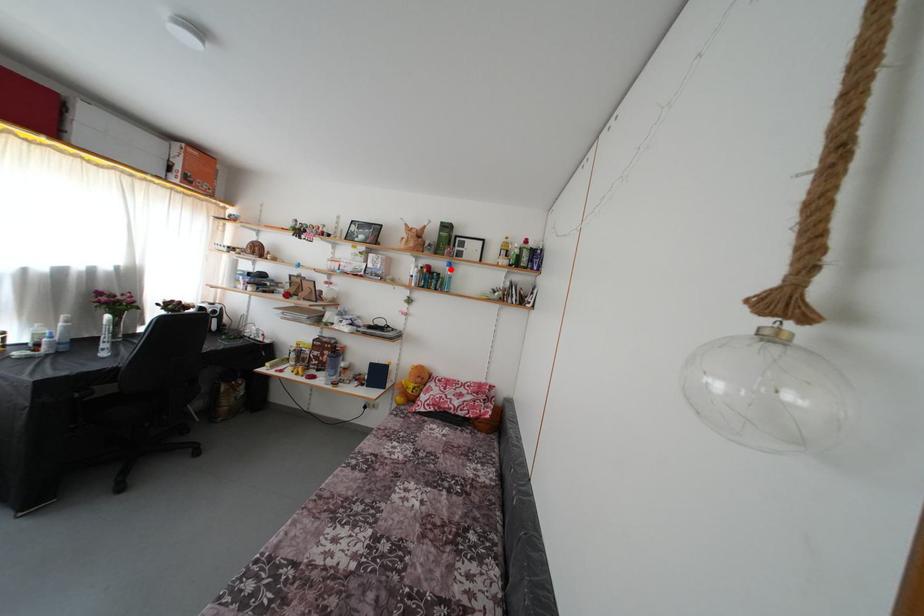
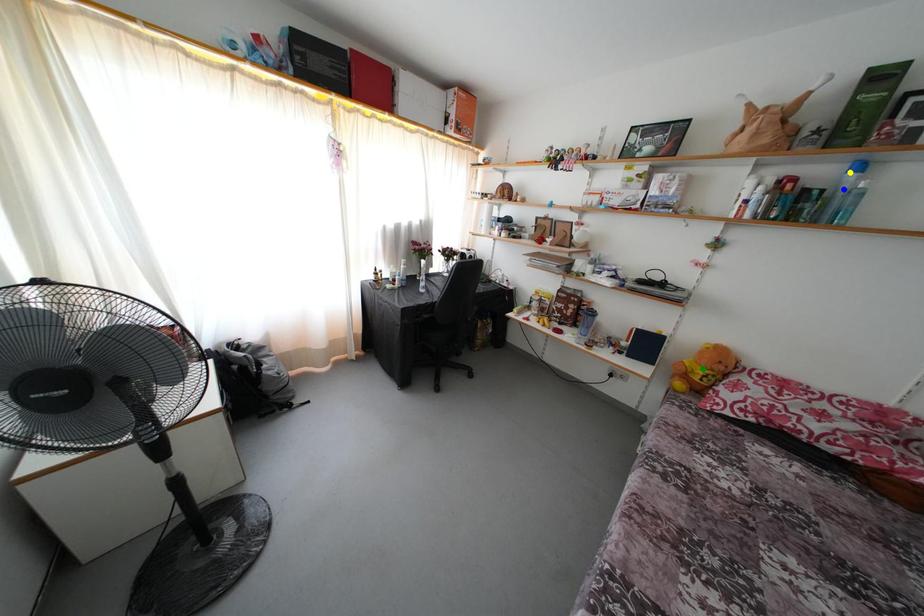
Question: I am providing you with two images of the same scene from different viewpoints. A red point is marked on the first image. You are given multiple points on the second image. Which point in image 2 represents the same 3d spot as the red point in image 1?

Choices:
 (A) green point
 (B) yellow point
 (C) blue point

Answer: (B)